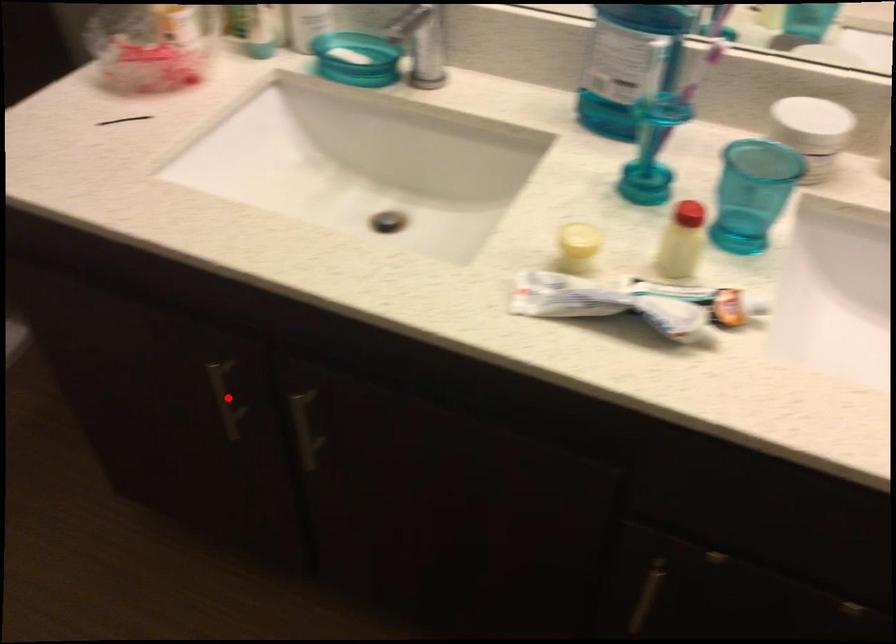
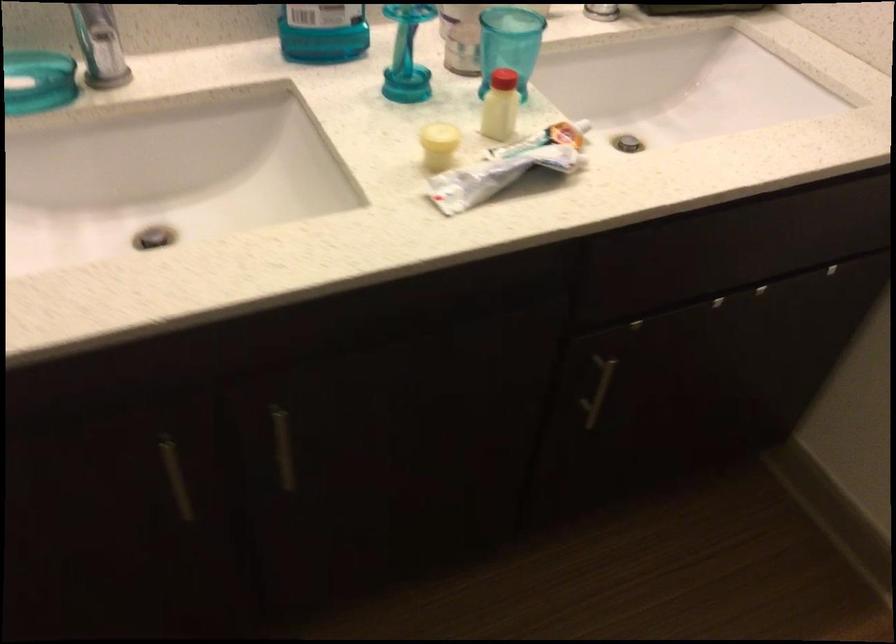
Locate, in the second image, the point that corresponds to the highlighted location in the first image.

(176, 477)